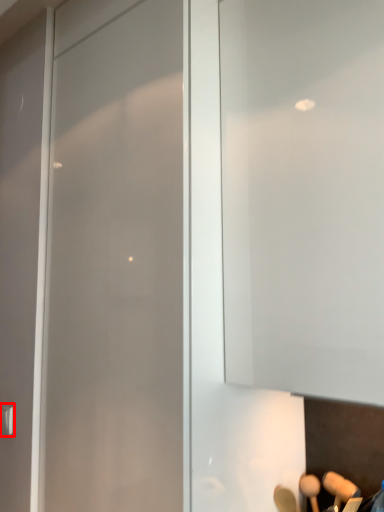
Question: Observing the image, what is the correct spatial positioning of door handle (annotated by the red box) in reference to glass door?

Choices:
 (A) right
 (B) left

Answer: (B)